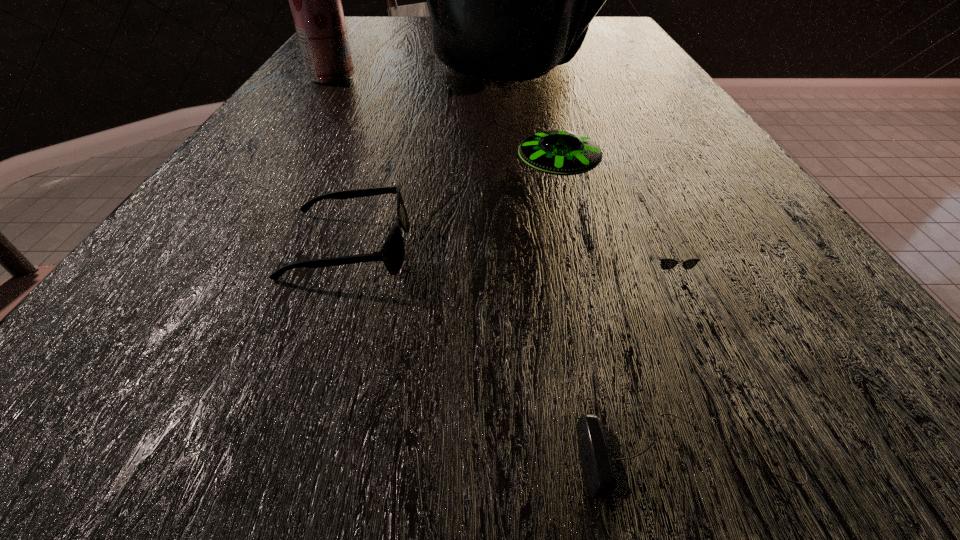
The image size is (960, 540). I want to click on free space located 0.290m on the back of the fruit juice, so click(x=361, y=33).

Locate an element on the screen. vacant region located on the front of the fourth nearest object is located at coordinates (596, 329).

Where is `free spot located 0.210m on the front-facing side of the left sunglasses`? Image resolution: width=960 pixels, height=540 pixels. free spot located 0.210m on the front-facing side of the left sunglasses is located at coordinates (566, 248).

You are a GUI agent. You are given a task and a screenshot of the screen. Output one action in this format:
    pyautogui.click(x=<x>, y=<y>)
    Task: Click on the free space located in front of the lenses of the right sunglasses
    
    Given the screenshot: What is the action you would take?
    pyautogui.click(x=684, y=322)

You are a GUI agent. You are given a task and a screenshot of the screen. Output one action in this format:
    pyautogui.click(x=<x>, y=<y>)
    Task: Click on the vacant space positioned 0.130m on the front-facing side of the webcam
    
    Given the screenshot: What is the action you would take?
    pyautogui.click(x=425, y=460)

Find the location of a particular element. Image resolution: width=960 pixels, height=540 pixels. free location located 0.260m on the front-facing side of the webcam is located at coordinates (276, 460).

This screenshot has width=960, height=540. Find the location of `vacant space located 0.250m on the front-facing side of the webcam`. vacant space located 0.250m on the front-facing side of the webcam is located at coordinates (287, 460).

Locate an element on the screen. The height and width of the screenshot is (540, 960). object that is at the far edge is located at coordinates (509, 0).

I want to click on object positioned at the near edge, so click(600, 454).

Locate an element on the screen. object located at the left edge is located at coordinates (315, 0).